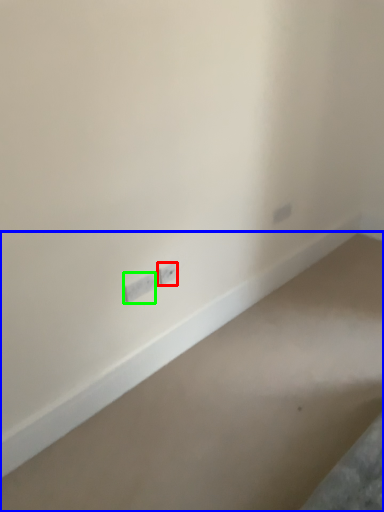
Question: Estimate the real-world distances between objects in this image. Which object is closer to power plugs and sockets (highlighted by a red box), concrete (highlighted by a blue box) or power plugs and sockets (highlighted by a green box)?

Choices:
 (A) concrete
 (B) power plugs and sockets

Answer: (B)